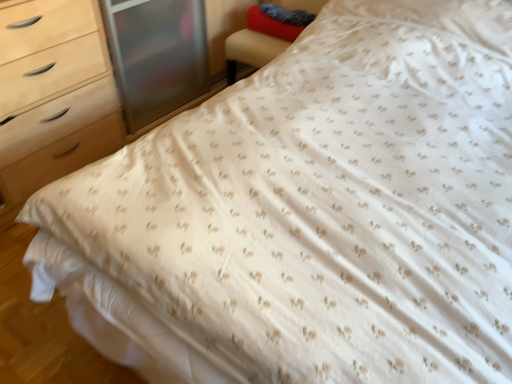
Question: From their relative heights in the image, would you say velvet blue pillow at upper right, which is the first pillow in front-to-back order, is taller or shorter than velvet-like red pillow at upper right, which appears as the second pillow when viewed from the front?

Choices:
 (A) short
 (B) tall

Answer: (A)

Question: From a real-world perspective, relative to velvet-like red pillow at upper right, which appears as the second pillow when viewed from the front, is velvet blue pillow at upper right, which is the first pillow in front-to-back order, vertically above or below?

Choices:
 (A) below
 (B) above

Answer: (B)

Question: Based on their relative distances, which object is farther from the velvet-like red pillow at upper right, arranged as the first pillow when viewed from the back?

Choices:
 (A) red fabric armchair at upper right
 (B) velvet blue pillow at upper right, which is the first pillow in front-to-back order

Answer: (A)

Question: Based on their relative distances, which object is farther from the velvet blue pillow at upper right, which is the first pillow in front-to-back order?

Choices:
 (A) velvet-like red pillow at upper right, which appears as the second pillow when viewed from the front
 (B) red fabric armchair at upper right

Answer: (B)